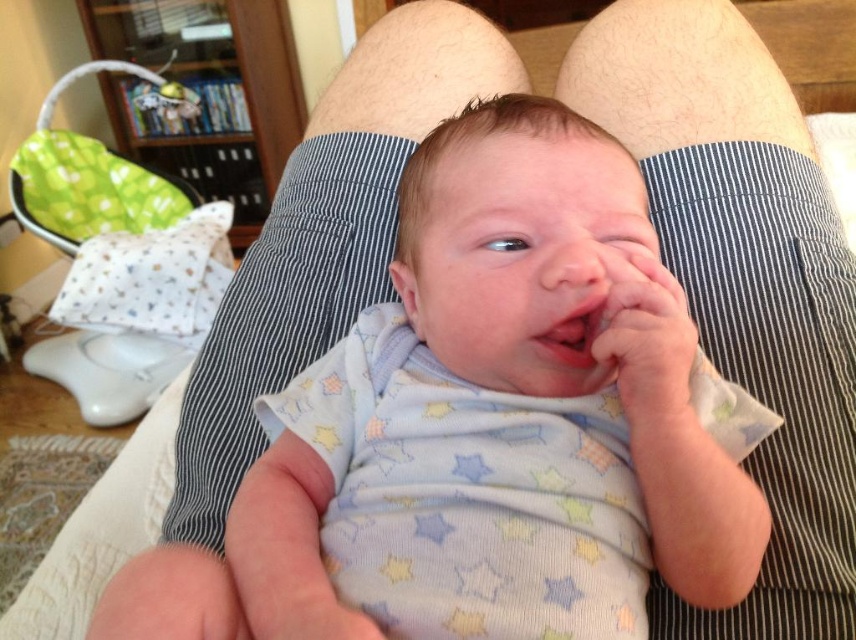
You are a pediatrician observing the baby in the image. The baby has a smooth skin hand at center and pink smooth lips at center. Which object is located below the other?

The smooth skin hand at center is positioned under the pink smooth lips at center, meaning the hand is below the lips.

You are a photographer trying to capture the baby in the center of the image. The camera requires the baby to be positioned at point 0.5 on the x and y axes. According to the scene, where is the white soft fabric baby at center located?

The white soft fabric baby at center is located at point 0.669 on the x axis and 0.568 on the y axis, which is slightly to the right and above the center point of 0.5 on both axes.

You are a photographer taking a picture of the white soft fabric baby at center and the smooth skin hand at center. Which object should you focus on first if you want to capture both in the same frame without moving the camera?

The white soft fabric baby at center is much taller than the smooth skin hand at center, so you should focus on the white soft fabric baby at center first to ensure it fills the frame appropriately before adjusting for the smaller hand.